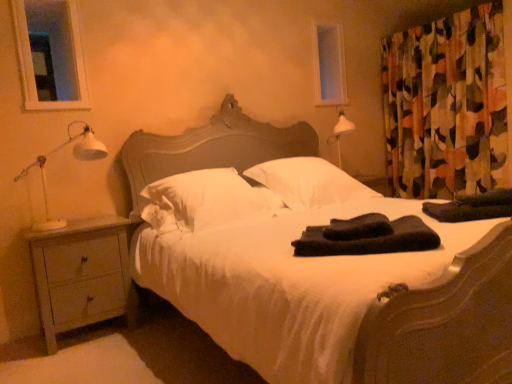
Question: Is black soft towels at center, the 1th material viewed from the left, looking in the opposite direction of white soft pillow at center, positioned as the first pillow in left-to-right order?

Choices:
 (A) yes
 (B) no

Answer: (B)

Question: Is black soft towels at center, the 1th material viewed from the left, positioned behind white soft pillow at center, positioned as the first pillow in left-to-right order?

Choices:
 (A) yes
 (B) no

Answer: (B)

Question: Is black soft towels at center, the 1th material positioned from the front, positioned far away from white soft pillow at center, which is the 2th pillow in right-to-left order?

Choices:
 (A) yes
 (B) no

Answer: (B)

Question: From a real-world perspective, is black soft towels at center, the 1th material positioned from the front, below white soft pillow at center, positioned as the first pillow in left-to-right order?

Choices:
 (A) no
 (B) yes

Answer: (B)

Question: Considering the relative sizes of black soft towels at center, the 1th material positioned from the front, and white soft pillow at center, positioned as the first pillow in left-to-right order, in the image provided, is black soft towels at center, the 1th material positioned from the front, wider than white soft pillow at center, positioned as the first pillow in left-to-right order,?

Choices:
 (A) no
 (B) yes

Answer: (A)

Question: Visually, is white satin bed at center positioned to the left or to the right of black towel at right, which ranks as the 2th material in front-to-back order?

Choices:
 (A) left
 (B) right

Answer: (A)

Question: Looking at their shapes, would you say white satin bed at center is wider or thinner than black towel at right, the first material when ordered from back to front?

Choices:
 (A) thin
 (B) wide

Answer: (B)

Question: Which is correct: white satin bed at center is inside black towel at right, which is the second material in left-to-right order, or outside of it?

Choices:
 (A) outside
 (B) inside

Answer: (A)

Question: From a real-world perspective, relative to black towel at right, which ranks as the 2th material in front-to-back order, is white satin bed at center vertically above or below?

Choices:
 (A) below
 (B) above

Answer: (B)

Question: In the image, is white satin bed at center positioned in front of or behind light gray wood nightstand at lower left?

Choices:
 (A) front
 (B) behind

Answer: (A)

Question: From a real-world perspective, is white satin bed at center above or below light gray wood nightstand at lower left?

Choices:
 (A) above
 (B) below

Answer: (A)

Question: In terms of size, does white satin bed at center appear bigger or smaller than light gray wood nightstand at lower left?

Choices:
 (A) small
 (B) big

Answer: (B)

Question: Is white satin bed at center wider or thinner than light gray wood nightstand at lower left?

Choices:
 (A) wide
 (B) thin

Answer: (A)

Question: From a real-world perspective, is transparent glass window at upper left, the 2th window screen positioned from the right, physically located above or below white matte table lamp at left?

Choices:
 (A) below
 (B) above

Answer: (B)

Question: Is transparent glass window at upper left, which is the second window screen in back-to-front order, situated inside white matte table lamp at left or outside?

Choices:
 (A) inside
 (B) outside

Answer: (B)